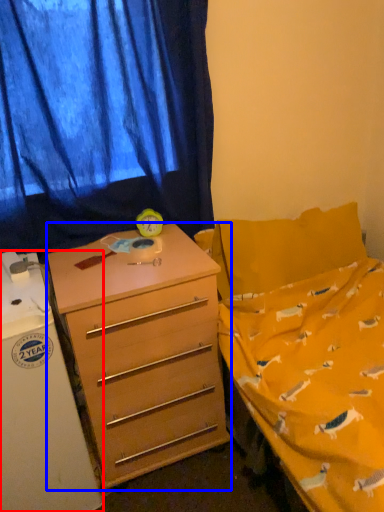
Question: Which object appears farthest to the camera in this image, refrigerator (highlighted by a red box) or desk (highlighted by a blue box)?

Choices:
 (A) refrigerator
 (B) desk

Answer: (B)